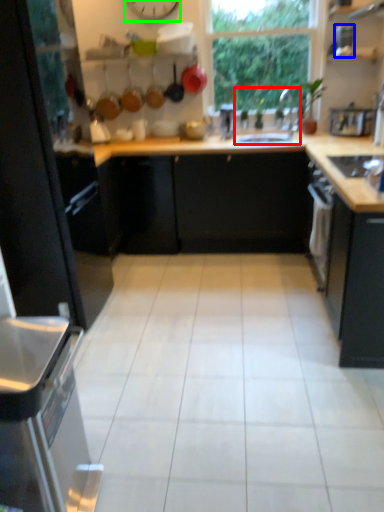
Question: Estimate the real-world distances between objects in this image. Which object is farther from sink (highlighted by a red box), appliance (highlighted by a blue box) or clock (highlighted by a green box)?

Choices:
 (A) appliance
 (B) clock

Answer: (B)